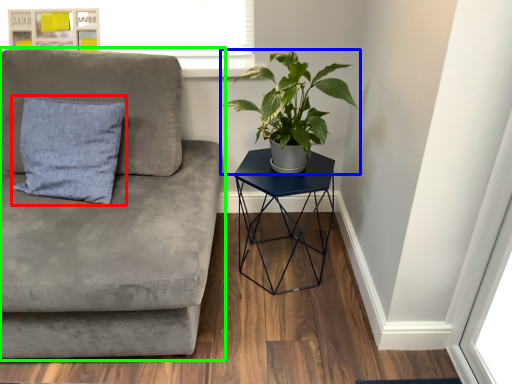
Question: Which is farther away from pillow (highlighted by a red box)? houseplant (highlighted by a blue box) or studio couch (highlighted by a green box)?

Choices:
 (A) houseplant
 (B) studio couch

Answer: (A)